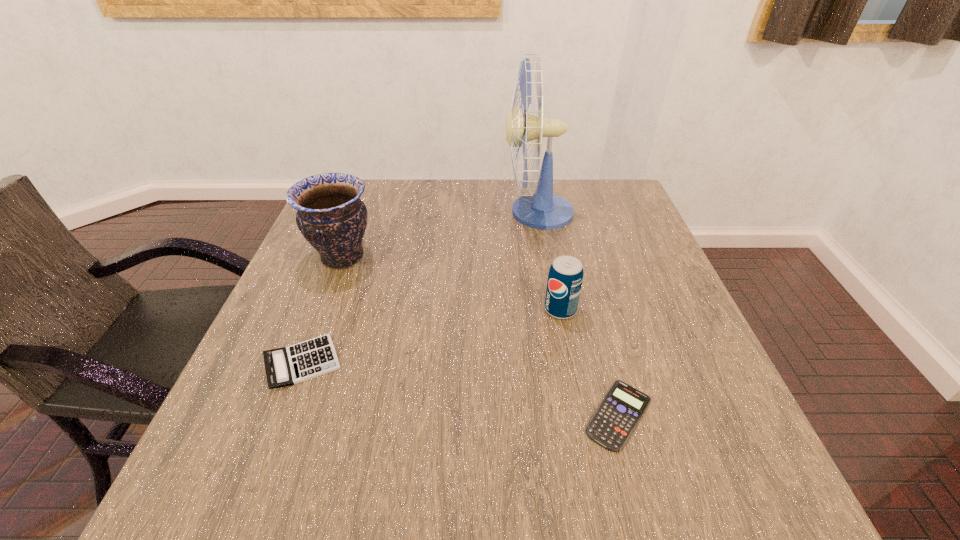
Identify the location of vacant area situated 0.330m at the front of the fan where the blades are visible. (386, 213).

Identify the location of free space located on the front handle of the pottery. Image resolution: width=960 pixels, height=540 pixels. (445, 258).

Where is `free point located 0.370m on the left of the third farthest object`? The width and height of the screenshot is (960, 540). free point located 0.370m on the left of the third farthest object is located at coordinates (372, 309).

Where is `vacant space situated on the back of the taller calculator`? The width and height of the screenshot is (960, 540). vacant space situated on the back of the taller calculator is located at coordinates (348, 244).

The image size is (960, 540). Identify the location of free point located 0.170m on the left of the shortest object. (483, 415).

Find the location of `object that is positioned at the far edge`. object that is positioned at the far edge is located at coordinates (542, 210).

In order to click on pottery that is at the left edge in this screenshot , I will do `click(331, 216)`.

Locate an element on the screen. calculator present at the left edge is located at coordinates (286, 366).

You are a GUI agent. You are given a task and a screenshot of the screen. Output one action in this format:
    pyautogui.click(x=<x>, y=<y>)
    Task: Click on the object that is at the right edge
    The height and width of the screenshot is (540, 960).
    Given the screenshot: What is the action you would take?
    pyautogui.click(x=611, y=426)

Image resolution: width=960 pixels, height=540 pixels. Find the location of `free spot at the far edge of the desktop`. free spot at the far edge of the desktop is located at coordinates (434, 213).